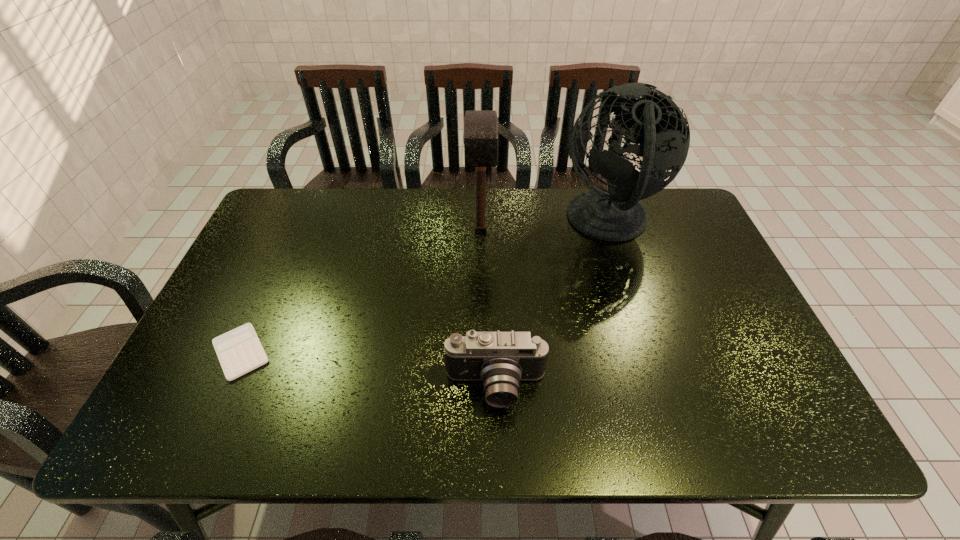
Identify the location of vacant space that satisfies the following two spatial constraints: 1. on the front-facing side of the tallest object; 2. on the front side of the leftmost object. (650, 352).

Identify the location of vacant area in the image that satisfies the following two spatial constraints: 1. on the front-facing side of the tallest object; 2. on the front side of the calculator. This screenshot has width=960, height=540. (650, 352).